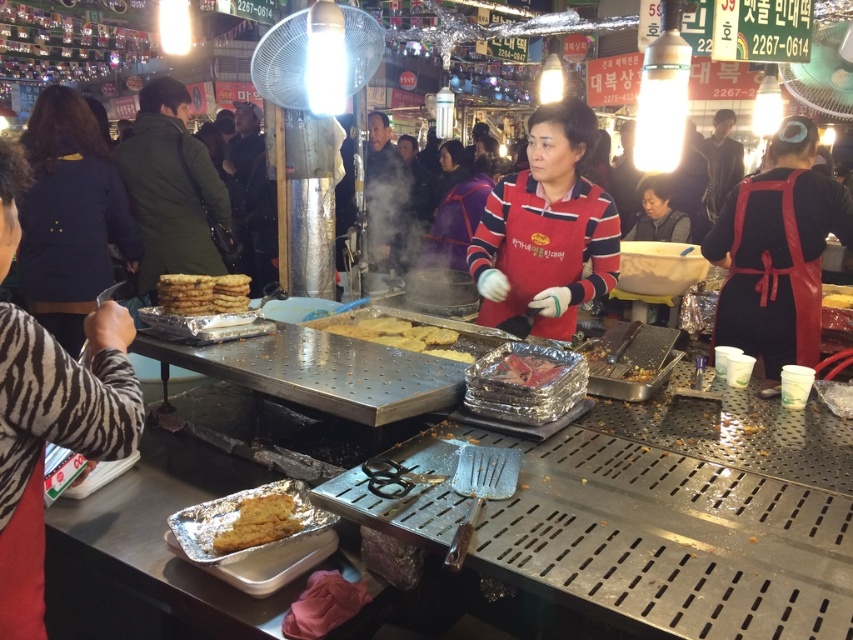
You are a customer at the street food market and want to buy the yellow matte cake at lower left and the shiny metallic foil at center. The vendor tells you that the item closer to the ground is free today. Which item can you get for free?

The yellow matte cake at lower left is located below the shiny metallic foil at center, so it is closer to the ground. Therefore, you can get the yellow matte cake at lower left for free.

From the picture: You are a customer at the street food market and want to buy the golden crispy pastry at center. Based on the coordinates provided, where should you go to find it?

The golden crispy pastry at center is located at point (202, 292), so you should go to that coordinate to find it.

Looking at this image, you are a food critic standing at the entrance of the street food market. You want to take a photo of the golden crispy pastry at center without moving closer. Is the pastry within the standard camera focus range of 8 feet?

The golden crispy pastry at center is 6.37 feet away from the camera, which is within the standard camera focus range of 8 feet. Therefore, the pastry can be captured clearly without moving closer.